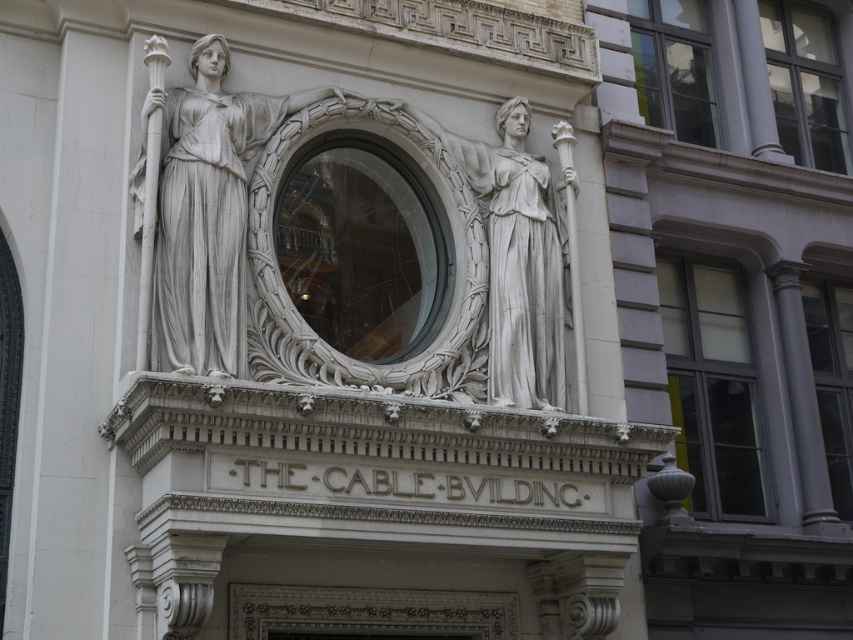
Looking at this image, who is lower down, white marble statue at center or white stone statue at center?

white stone statue at center is below.

Is white marble statue at center to the left of white stone statue at center from the viewer's perspective?

Correct, you'll find white marble statue at center to the left of white stone statue at center.

Is point (200, 196) closer to camera compared to point (553, 360)?

Yes, point (200, 196) is in front of point (553, 360).

The width and height of the screenshot is (853, 640). Find the location of `white marble statue at center`. white marble statue at center is located at coordinates (202, 212).